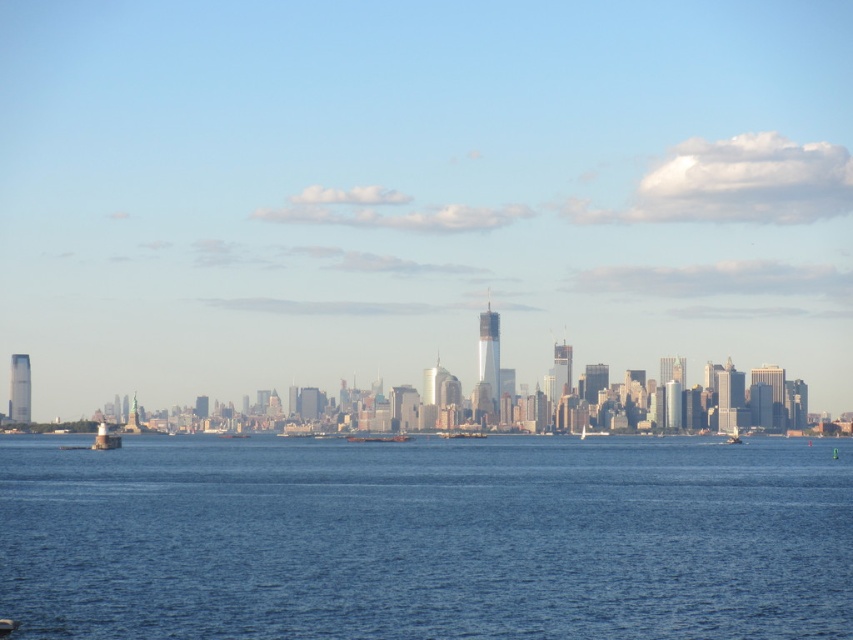
Question: Which point is closer to the camera?

Choices:
 (A) (258, 115)
 (B) (459, 435)
 (C) (55, 472)
 (D) (225, 432)

Answer: (B)

Question: Does transparent glass skyscrapers at center have a greater width compared to blue liquid water at center?

Choices:
 (A) yes
 (B) no

Answer: (A)

Question: Which object is farther from the camera taking this photo?

Choices:
 (A) metallic gray boat at center
 (B) metallic silver boat at center

Answer: (A)

Question: Can you confirm if blue liquid water at center is wider than metallic silver boat at center?

Choices:
 (A) yes
 (B) no

Answer: (A)

Question: Which point is closer to the camera taking this photo?

Choices:
 (A) (805, 65)
 (B) (479, 436)

Answer: (B)

Question: Is transparent glass skyscrapers at center wider than blue liquid water at center?

Choices:
 (A) no
 (B) yes

Answer: (B)